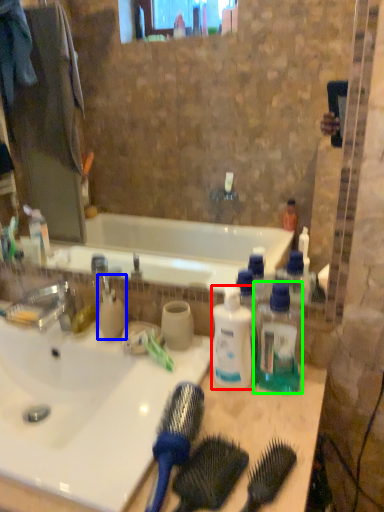
Question: Which is nearer to the bottle (highlighted by a red box)? cleaning product (highlighted by a blue box) or bottle (highlighted by a green box).

Choices:
 (A) cleaning product
 (B) bottle

Answer: (B)